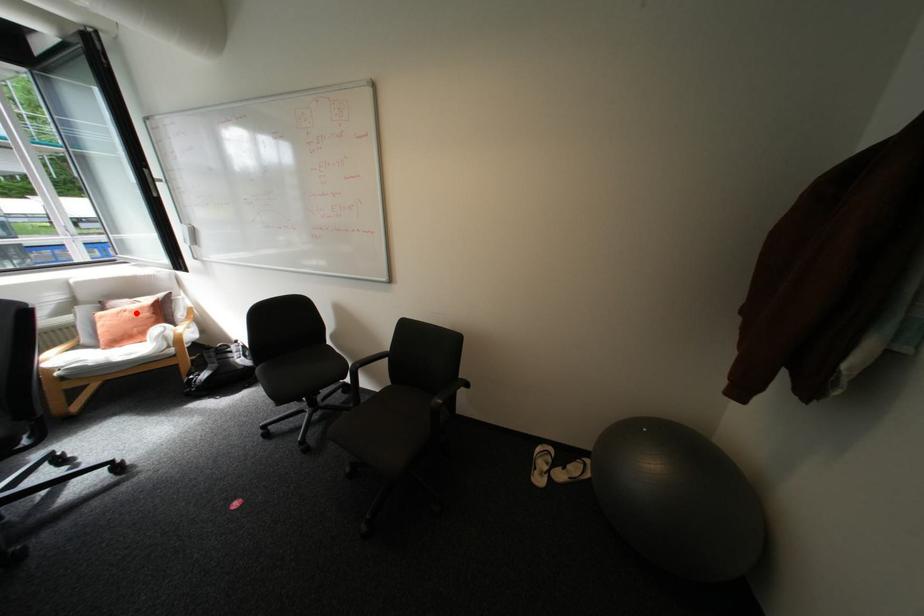
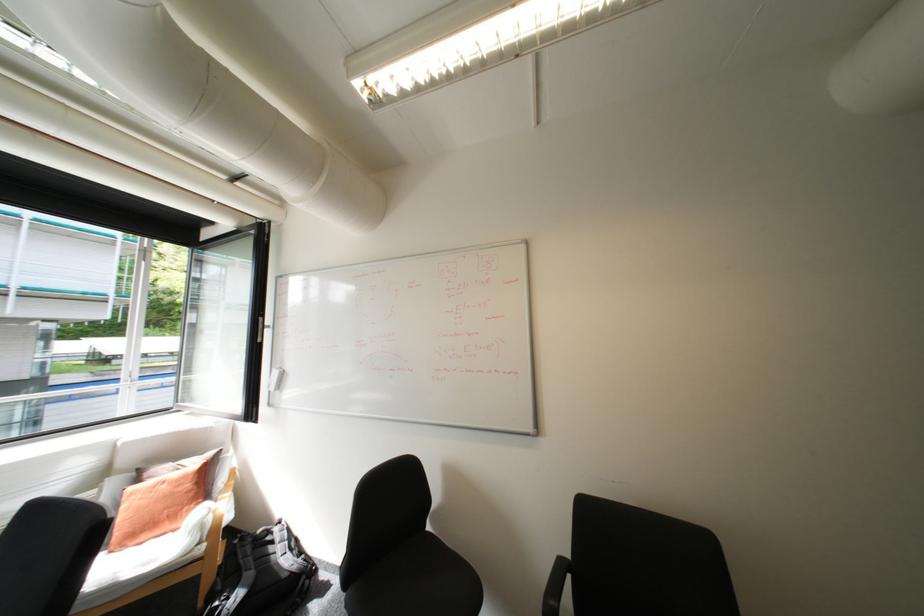
Find the pixel in the second image that matches the highlighted location in the first image.

(175, 485)